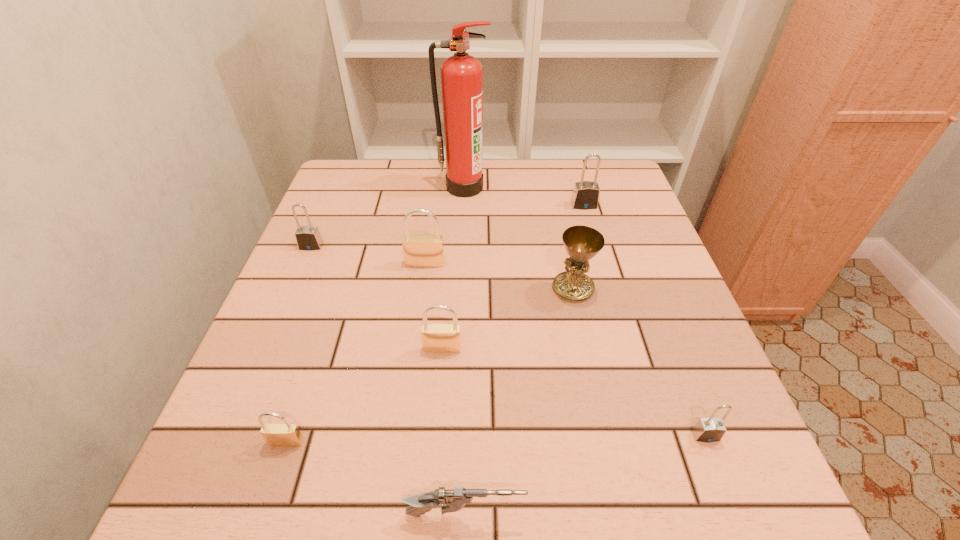
At what (x,y) coordinates should I click in order to perform the action: click on the sixth farthest object. Please return your answer as a coordinate pair (x, y). Looking at the image, I should click on (437, 338).

Locate an element on the screen. The width and height of the screenshot is (960, 540). the rightmost padlock is located at coordinates (710, 429).

Locate an element on the screen. This screenshot has width=960, height=540. the rightmost gray padlock is located at coordinates (710, 429).

Locate an element on the screen. the smallest brass padlock is located at coordinates (276, 435).

Locate an element on the screen. This screenshot has height=540, width=960. the leftmost brass padlock is located at coordinates (276, 435).

Where is `the nearest object`? The height and width of the screenshot is (540, 960). the nearest object is located at coordinates (450, 500).

I want to click on blank space located 0.130m with the nozzle pointing from the back of the fire extinguisher, so click(x=462, y=227).

Where is `free spot located 0.190m on the shackle of the second farthest object`? Image resolution: width=960 pixels, height=540 pixels. free spot located 0.190m on the shackle of the second farthest object is located at coordinates (599, 258).

At what (x,y) coordinates should I click in order to perform the action: click on free space located 0.320m on the front-facing side of the third farthest padlock. Please return your answer as a coordinate pair (x, y). This screenshot has height=540, width=960. Looking at the image, I should click on (408, 393).

The width and height of the screenshot is (960, 540). I want to click on vacant space situated on the left of the chalice, so click(444, 288).